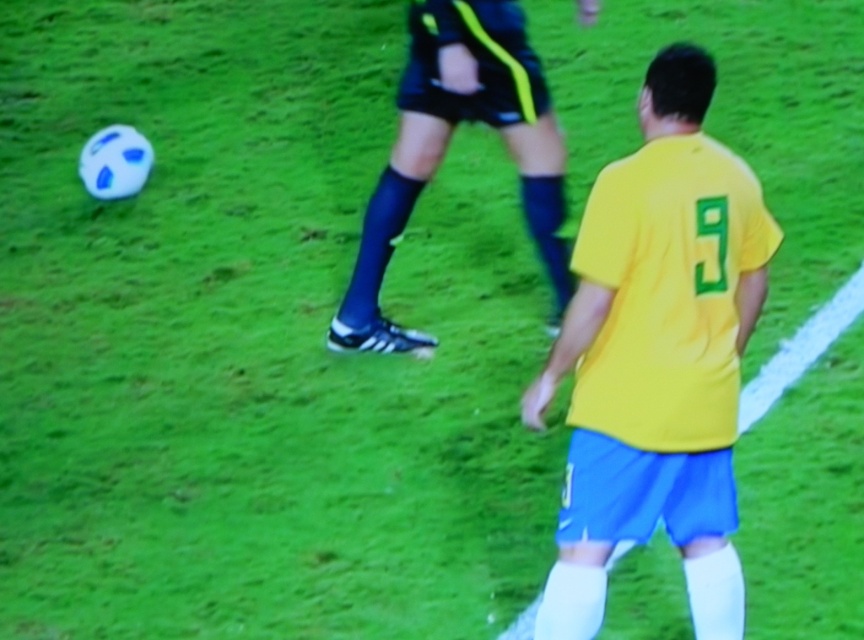
Based on the photo, does yellow matte jersey at center appear on the right side of black synthetic shorts at center?

Indeed, yellow matte jersey at center is positioned on the right side of black synthetic shorts at center.

Is point (582, 522) closer to viewer compared to point (537, 188)?

Yes, point (582, 522) is in front of point (537, 188).

At what (x,y) coordinates should I click in order to perform the action: click on yellow matte jersey at center. Please return your answer as a coordinate pair (x, y). Looking at the image, I should click on (658, 356).